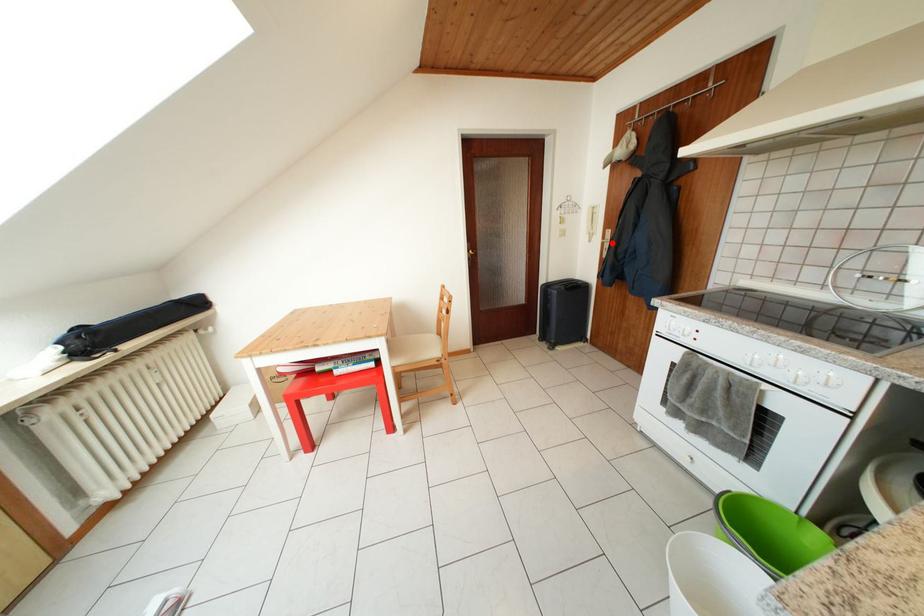
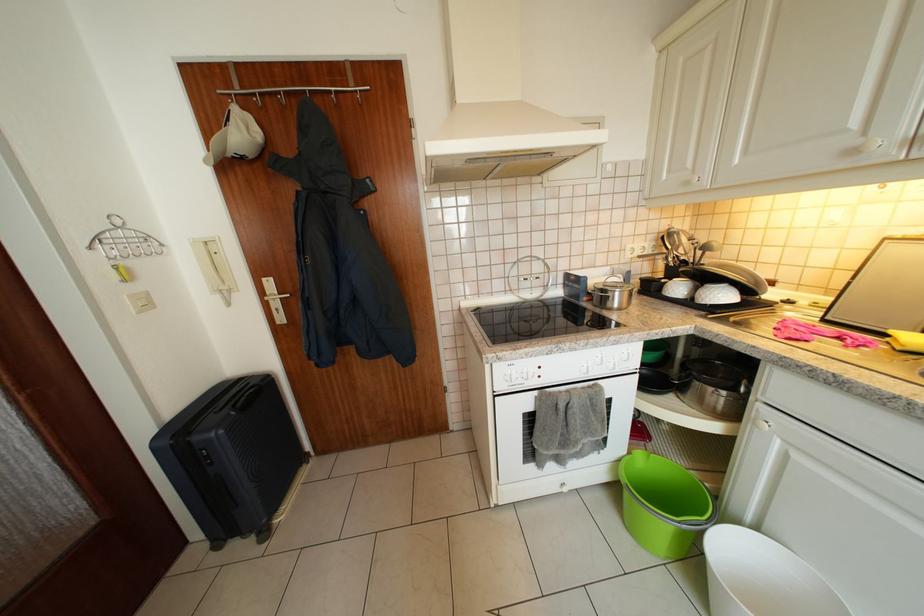
In the second image, find the point that corresponds to the highlighted location in the first image.

(271, 299)